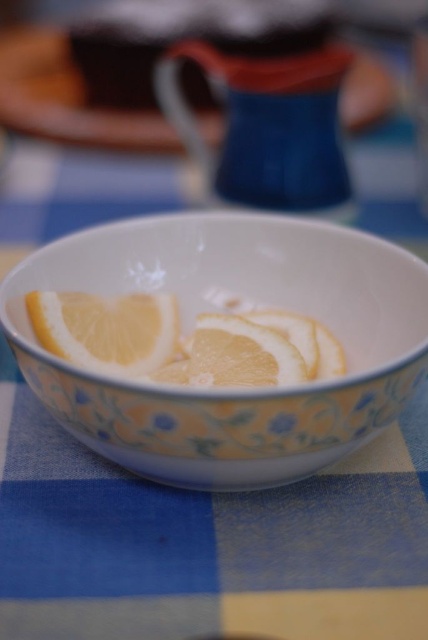
You are a chef preparing a garnish for a dish. You have a white glossy bowl at center and a yellow matte lemon at center. If you need to place the lemon precisely in the bowl, can you estimate whether the lemon will fit into the bowl based on their positions?

The distance between the white glossy bowl at center and the yellow matte lemon at center is 5.41 inches. Since the lemon needs to be placed inside the bowl, the distance suggests they are separate objects, so the lemon is not already in the bowl. However, without knowing the size of the lemon and the bowl, it is impossible to determine if it will fit based solely on the distance between them.

Based on the photo, you have a small container that is exactly the same size as the yellow matte orange at center. Can you fit it into the white glossy bowl at center without any part sticking out?

The white glossy bowl at center has a greater width than the yellow matte orange at center, so yes, the container can fit inside the white glossy bowl at center without any part sticking out.

You have a small plate that can only hold one fruit. If you want to place either the yellow matte lemon at center or the yellow matte orange at center on the plate, which fruit would you choose based on their sizes?

The yellow matte lemon at center might be wider than the yellow matte orange at center, so you should choose the lemon to fit on the plate since it is possibly wider.